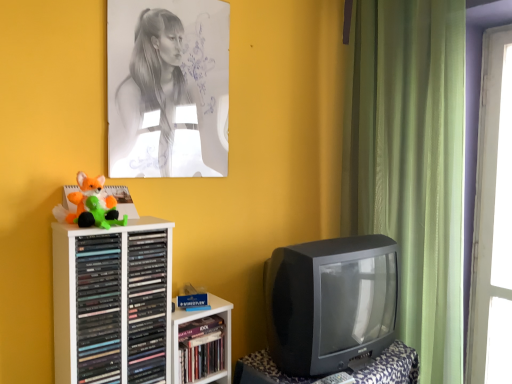
Identify the location of free space above black plastic television at right (from a real-world perspective). (346, 240).